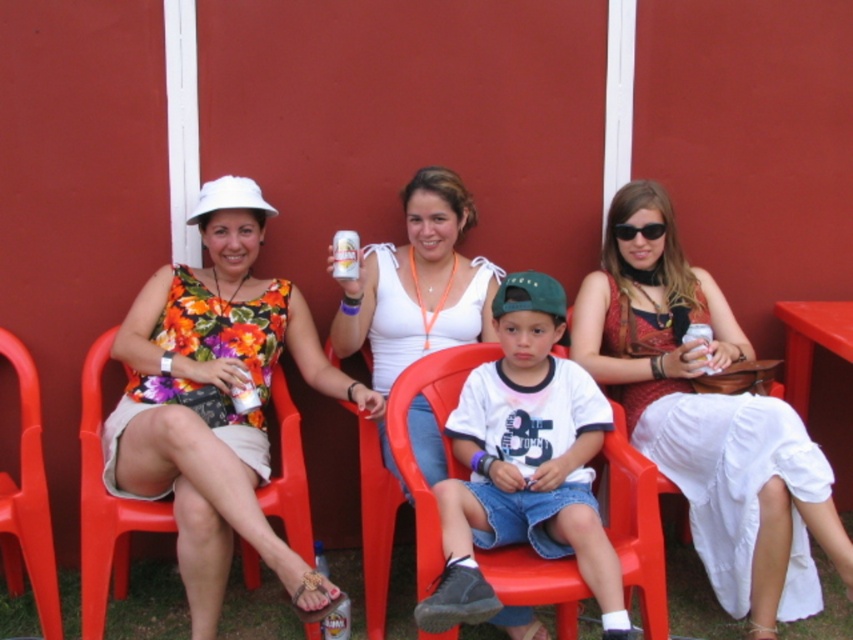
Based on the scene description, can the white fabric baseball hat at left fit inside the matte red dress at center?

The matte red dress at center is wider than the white fabric baseball hat at left, so yes, the hat can fit inside the dress.

Based on the scene description, can you determine the spatial relationship between the matte red dress at center and the black plastic sunglasses at upper center?

The matte red dress at center is located below the black plastic sunglasses at upper center.

What is the coordinate of the red plastic chair at left?

The red plastic chair at left is located at coordinate point (105, 504).